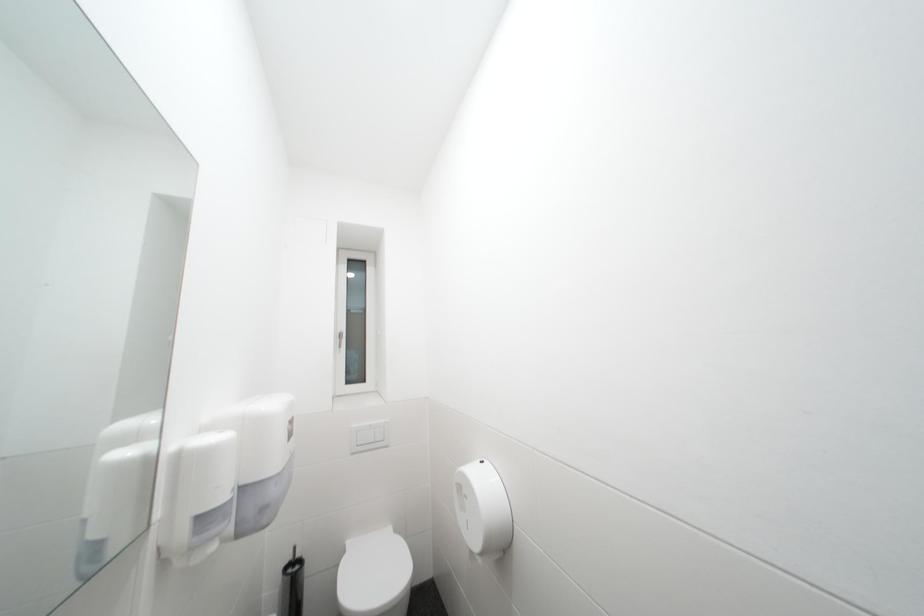
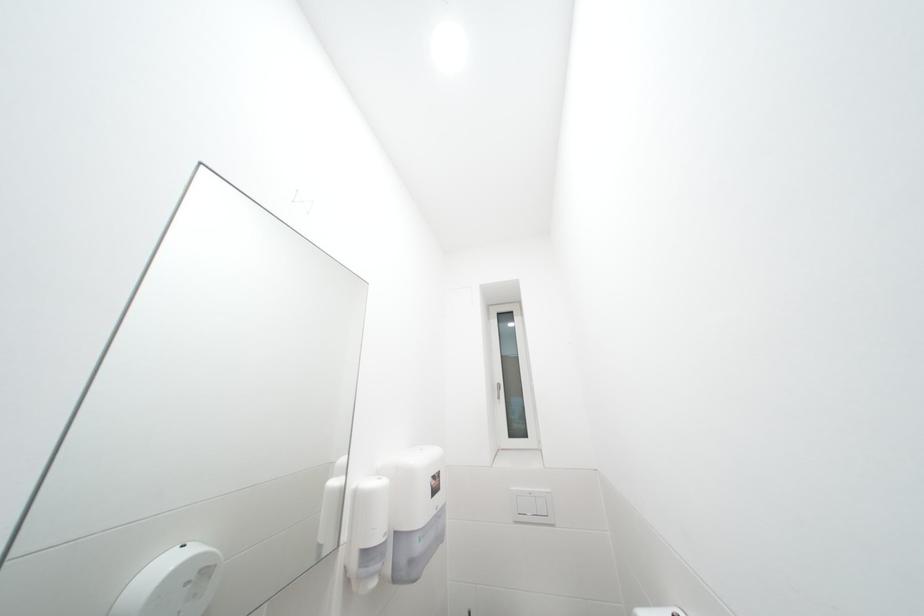
Question: The camera is either moving clockwise (left) or counter-clockwise (right) around the object. The first image is from the beginning of the video and the second image is from the end. Is the camera moving left or right when shooting the video?

Choices:
 (A) Left
 (B) Right

Answer: (B)